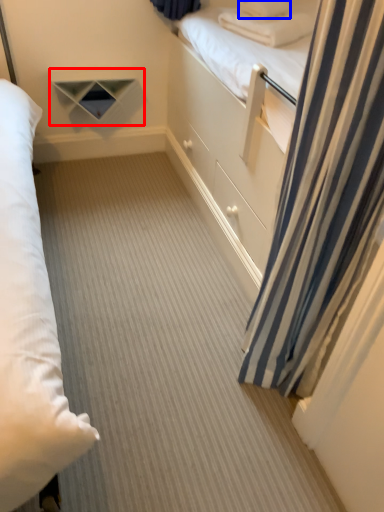
Question: Which point is further to the camera, shelf (highlighted by a red box) or pillow (highlighted by a blue box)?

Choices:
 (A) shelf
 (B) pillow

Answer: (A)